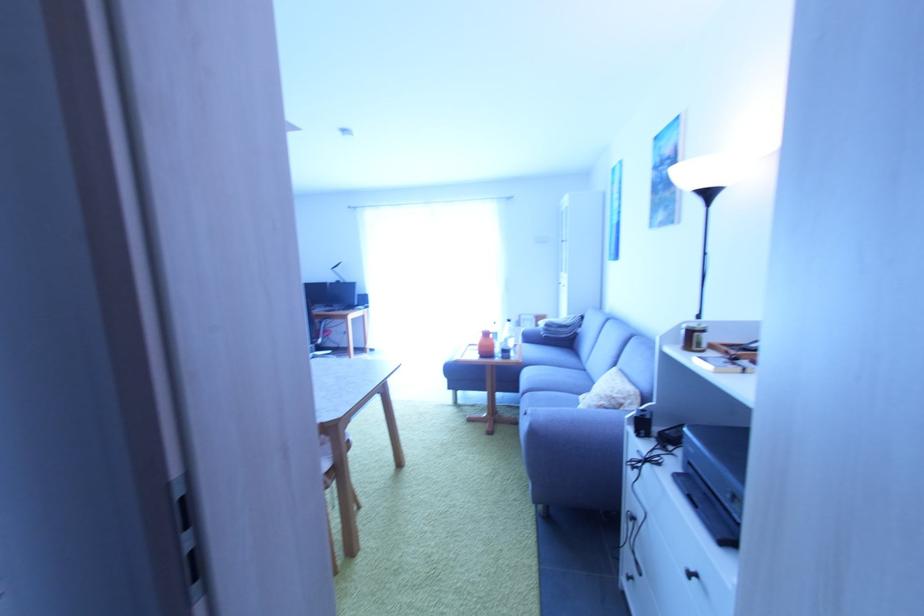
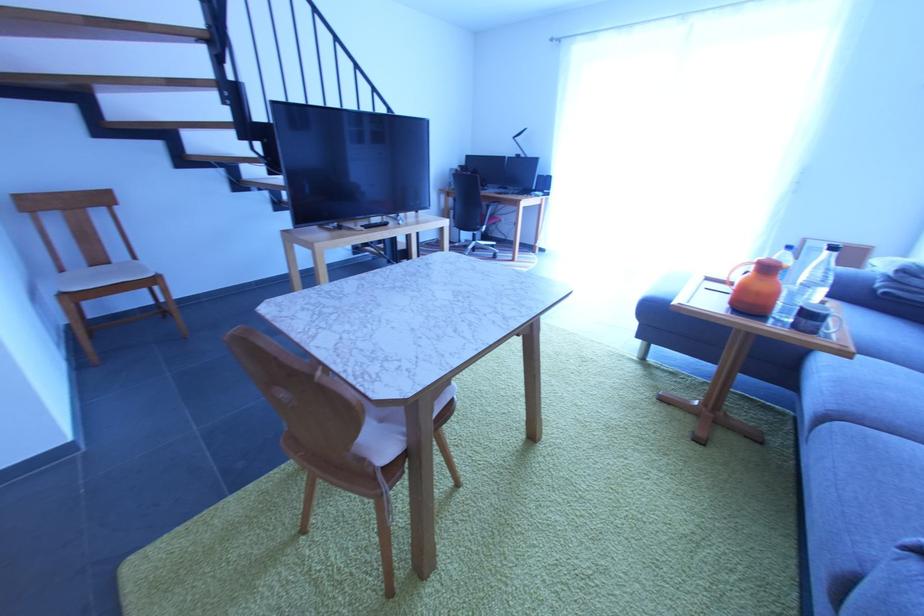
Find the pixel in the second image that matches point (496, 347) in the first image.

(779, 297)